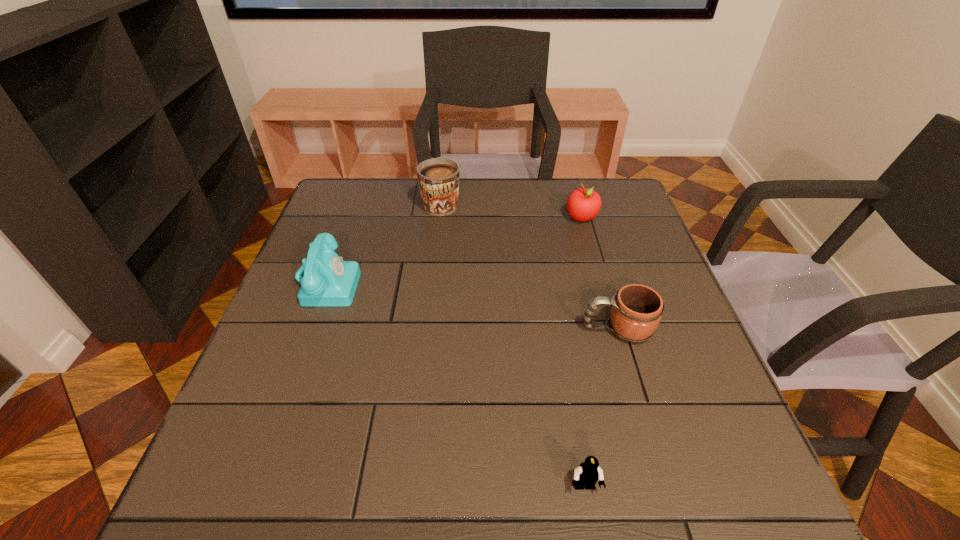
Where is `vacant area situated on the side of the shorter mug with the handle`? vacant area situated on the side of the shorter mug with the handle is located at coordinates (531, 329).

Identify the location of blank space located on the side of the shorter mug with the handle. This screenshot has height=540, width=960. (476, 329).

This screenshot has width=960, height=540. Find the location of `vacant space located 0.070m on the side of the shorter mug with the handle`. vacant space located 0.070m on the side of the shorter mug with the handle is located at coordinates (549, 329).

This screenshot has height=540, width=960. In order to click on mug at the far edge in this screenshot , I will do `click(438, 178)`.

Where is `apple located in the far edge section of the desktop`? The width and height of the screenshot is (960, 540). apple located in the far edge section of the desktop is located at coordinates (583, 204).

Locate an element on the screen. The height and width of the screenshot is (540, 960). object located in the near edge section of the desktop is located at coordinates (587, 474).

Find the location of a particular element. object located at the left edge is located at coordinates (329, 281).

Where is `apple at the right edge`? apple at the right edge is located at coordinates 583,204.

Find the location of a particular element. mug that is at the right edge is located at coordinates (636, 310).

You are a GUI agent. You are given a task and a screenshot of the screen. Output one action in this format:
    pyautogui.click(x=<x>, y=<y>)
    Task: Click on the object at the far right corner
    
    Given the screenshot: What is the action you would take?
    pyautogui.click(x=583, y=204)